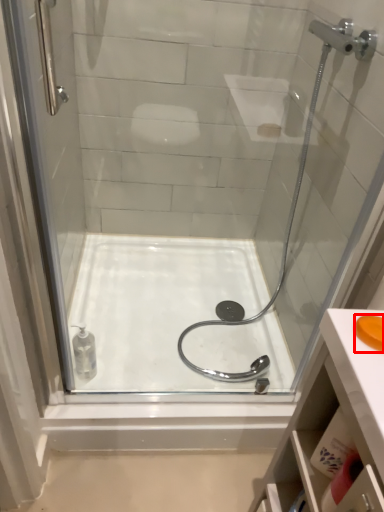
Question: In this image, where is soap (annotated by the red box) located relative to bath?

Choices:
 (A) left
 (B) right

Answer: (B)